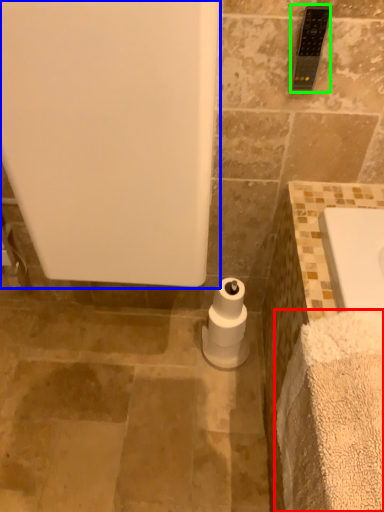
Question: Which is farther away from bath towel (highlighted by a red box)? bath (highlighted by a blue box) or towel bar (highlighted by a green box)?

Choices:
 (A) bath
 (B) towel bar

Answer: (B)